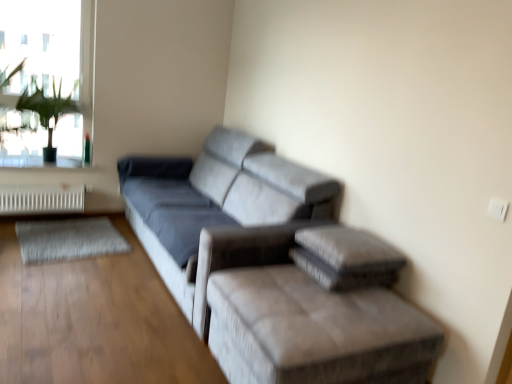
The image size is (512, 384). Describe the element at coordinates (274, 268) in the screenshot. I see `suede gray couch at center` at that location.

What is the approximate width of white metallic radiator at lower left?

white metallic radiator at lower left is 20.31 centimeters wide.

The height and width of the screenshot is (384, 512). I want to click on suede gray couch at center, so click(x=274, y=268).

Between green leafy plant at upper left and transparent glass window at upper left, which one has smaller width?

Thinner between the two is transparent glass window at upper left.

Does green leafy plant at upper left have a lesser height compared to transparent glass window at upper left?

Indeed, green leafy plant at upper left has a lesser height compared to transparent glass window at upper left.

Where is `plant on the right of transparent glass window at upper left`? The height and width of the screenshot is (384, 512). plant on the right of transparent glass window at upper left is located at coordinates (47, 112).

Can you confirm if velvet gray ottoman at lower right is wider than suede gray couch at center?

Incorrect, the width of velvet gray ottoman at lower right does not surpass that of suede gray couch at center.

Find the location of `furniture below the suede gray couch at center (from the image's perspective)`. furniture below the suede gray couch at center (from the image's perspective) is located at coordinates (307, 308).

Is suede gray couch at center at the back of velvet gray ottoman at lower right?

No, suede gray couch at center is not at the back of velvet gray ottoman at lower right.

From the image's perspective, is velvet gray ottoman at lower right located above or below suede gray couch at center?

Based on their image positions, velvet gray ottoman at lower right is located beneath suede gray couch at center.

From a real-world perspective, which object stands above the other?

velvet gray ottoman at lower right.

In terms of width, does white metallic radiator at lower left look wider or thinner when compared to velvet gray ottoman at lower right?

In the image, white metallic radiator at lower left appears to be more narrow than velvet gray ottoman at lower right.

You are a GUI agent. You are given a task and a screenshot of the screen. Output one action in this format:
    pyautogui.click(x=<x>, y=<y>)
    Task: Click on the furniture that appears above the white metallic radiator at lower left (from a real-world perspective)
    
    Given the screenshot: What is the action you would take?
    pyautogui.click(x=307, y=308)

Is white metallic radiator at lower left in front of velvet gray ottoman at lower right?

No, white metallic radiator at lower left is further to the viewer.

Would you consider transparent glass window at upper left to be distant from suede gray couch at center?

transparent glass window at upper left is positioned a significant distance from suede gray couch at center.

Considering the sizes of objects transparent glass window at upper left and suede gray couch at center in the image provided, who is bigger, transparent glass window at upper left or suede gray couch at center?

suede gray couch at center.

From the picture: Is transparent glass window at upper left inside or outside of suede gray couch at center?

transparent glass window at upper left is located beyond the bounds of suede gray couch at center.

Is transparent glass window at upper left facing away from suede gray couch at center?

transparent glass window at upper left is not turned away from suede gray couch at center.

Can you tell me how much suede gray couch at center and transparent glass window at upper left differ in facing direction?

They differ by 91.2 degrees in their facing directions.

Is suede gray couch at center to the left of transparent glass window at upper left from the viewer's perspective?

Incorrect, suede gray couch at center is not on the left side of transparent glass window at upper left.

From the image's perspective, which one is positioned lower, suede gray couch at center or transparent glass window at upper left?

suede gray couch at center, from the image's perspective.

How different are the orientations of suede gray couch at center and green leafy plant at upper left in degrees?

suede gray couch at center and green leafy plant at upper left are facing 91.9 degrees away from each other.

Which is more to the right, suede gray couch at center or green leafy plant at upper left?

suede gray couch at center.

Is suede gray couch at center oriented towards green leafy plant at upper left?

Yes, suede gray couch at center is turned towards green leafy plant at upper left.

Can you confirm if suede gray couch at center is bigger than green leafy plant at upper left?

Correct, suede gray couch at center is larger in size than green leafy plant at upper left.

Is velvet gray ottoman at lower right located within suede gray couch at center?

No.

Considering the relative sizes of suede gray couch at center and velvet gray ottoman at lower right in the image provided, is suede gray couch at center smaller than velvet gray ottoman at lower right?

Incorrect, suede gray couch at center is not smaller in size than velvet gray ottoman at lower right.

I want to click on furniture in front of the suede gray couch at center, so click(307, 308).

From a real-world perspective, who is located lower, suede gray couch at center or velvet gray ottoman at lower right?

In real-world perspective, velvet gray ottoman at lower right is lower.

This screenshot has height=384, width=512. Identify the location of window above the green leafy plant at upper left (from the image's perspective). (46, 79).

Identify the location of studio couch that is on the left side of velvet gray ottoman at lower right. (274, 268).

Which object lies nearer to the anchor point suede gray couch at center, white metallic radiator at lower left or transparent glass window at upper left?

white metallic radiator at lower left is closer to suede gray couch at center.

When comparing their distances from white metallic radiator at lower left, does transparent glass window at upper left or velvet gray ottoman at lower right seem closer?

Based on the image, transparent glass window at upper left appears to be nearer to white metallic radiator at lower left.

Considering their positions, is transparent glass window at upper left positioned further to suede gray couch at center than velvet gray ottoman at lower right?

transparent glass window at upper left lies further to suede gray couch at center than the other object.

Looking at the image, which one is located closer to green leafy plant at upper left, velvet gray ottoman at lower right or suede gray couch at center?

suede gray couch at center lies closer to green leafy plant at upper left than the other object.

From the image, which object appears to be nearer to green leafy plant at upper left, velvet gray ottoman at lower right or white metallic radiator at lower left?

The object closer to green leafy plant at upper left is white metallic radiator at lower left.

Based on their spatial positions, is velvet gray ottoman at lower right or green leafy plant at upper left closer to white metallic radiator at lower left?

green leafy plant at upper left lies closer to white metallic radiator at lower left than the other object.

When comparing their distances from velvet gray ottoman at lower right, does green leafy plant at upper left or transparent glass window at upper left seem further?

transparent glass window at upper left is positioned further to the anchor velvet gray ottoman at lower right.

When comparing their distances from velvet gray ottoman at lower right, does green leafy plant at upper left or white metallic radiator at lower left seem closer?

Based on the image, white metallic radiator at lower left appears to be nearer to velvet gray ottoman at lower right.

What are the coordinates of `studio couch between transparent glass window at upper left and velvet gray ottoman at lower right from left to right` in the screenshot? It's located at (274, 268).

You are a GUI agent. You are given a task and a screenshot of the screen. Output one action in this format:
    pyautogui.click(x=<x>, y=<y>)
    Task: Click on the plant between white metallic radiator at lower left and suede gray couch at center from left to right
    The image size is (512, 384).
    Given the screenshot: What is the action you would take?
    pyautogui.click(x=47, y=112)

Locate an element on the screen. This screenshot has height=384, width=512. studio couch between green leafy plant at upper left and velvet gray ottoman at lower right in the horizontal direction is located at coordinates (274, 268).

At what (x,y) coordinates should I click in order to perform the action: click on window located between white metallic radiator at lower left and velvet gray ottoman at lower right in the left-right direction. Please return your answer as a coordinate pair (x, y). The height and width of the screenshot is (384, 512). Looking at the image, I should click on (46, 79).